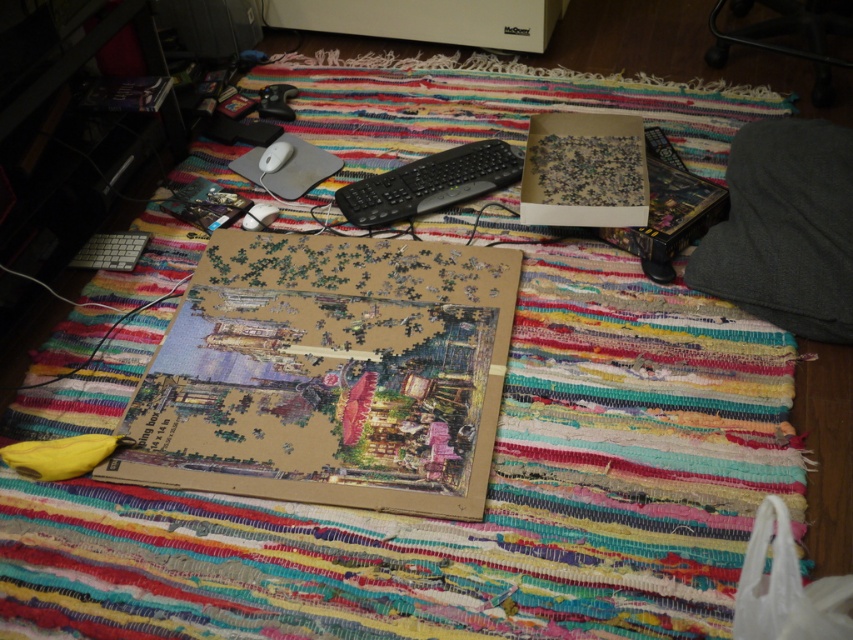
Question: Can you confirm if wooden jigsaw puzzle at center is positioned to the left of cardboard puzzle box at center?

Choices:
 (A) no
 (B) yes

Answer: (B)

Question: Is wooden jigsaw puzzle at center to the right of cardboard puzzle box at center from the viewer's perspective?

Choices:
 (A) yes
 (B) no

Answer: (B)

Question: Which object appears farthest from the camera in this image?

Choices:
 (A) wooden jigsaw puzzle at center
 (B) cardboard puzzle box at center

Answer: (B)

Question: Can you confirm if wooden jigsaw puzzle at center is positioned below cardboard puzzle box at center?

Choices:
 (A) no
 (B) yes

Answer: (B)